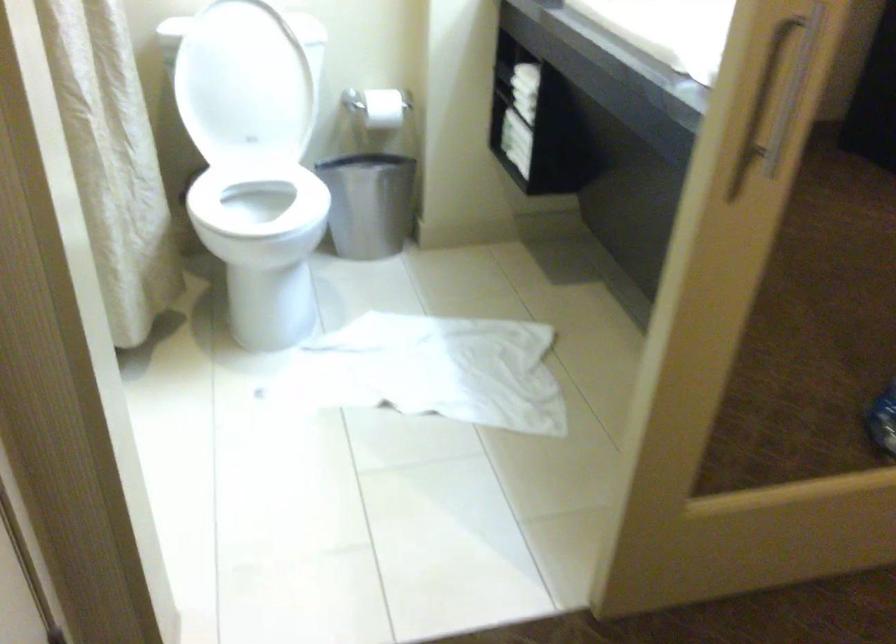
Locate an element on the screen. rolled white towel is located at coordinates (754, 422).